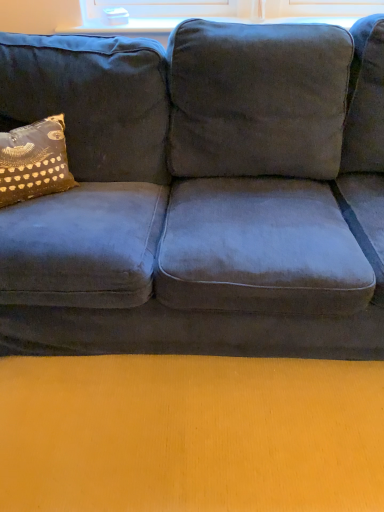
Question: In terms of height, does glassy white window sill at upper center look taller or shorter compared to gold-patterned fabric pillow at left?

Choices:
 (A) short
 (B) tall

Answer: (A)

Question: From a real-world perspective, relative to gold-patterned fabric pillow at left, is glassy white window sill at upper center vertically above or below?

Choices:
 (A) below
 (B) above

Answer: (B)

Question: Looking at their shapes, would you say glassy white window sill at upper center is wider or thinner than gold-patterned fabric pillow at left?

Choices:
 (A) wide
 (B) thin

Answer: (B)

Question: From their relative heights in the image, would you say gold-patterned fabric pillow at left is taller or shorter than glassy white window sill at upper center?

Choices:
 (A) short
 (B) tall

Answer: (B)

Question: Based on their positions, is gold-patterned fabric pillow at left located to the left or right of glassy white window sill at upper center?

Choices:
 (A) left
 (B) right

Answer: (A)

Question: Does point (36, 187) appear closer or farther from the camera than point (117, 29)?

Choices:
 (A) closer
 (B) farther

Answer: (A)

Question: From a real-world perspective, relative to glassy white window sill at upper center, is gold-patterned fabric pillow at left vertically above or below?

Choices:
 (A) below
 (B) above

Answer: (A)